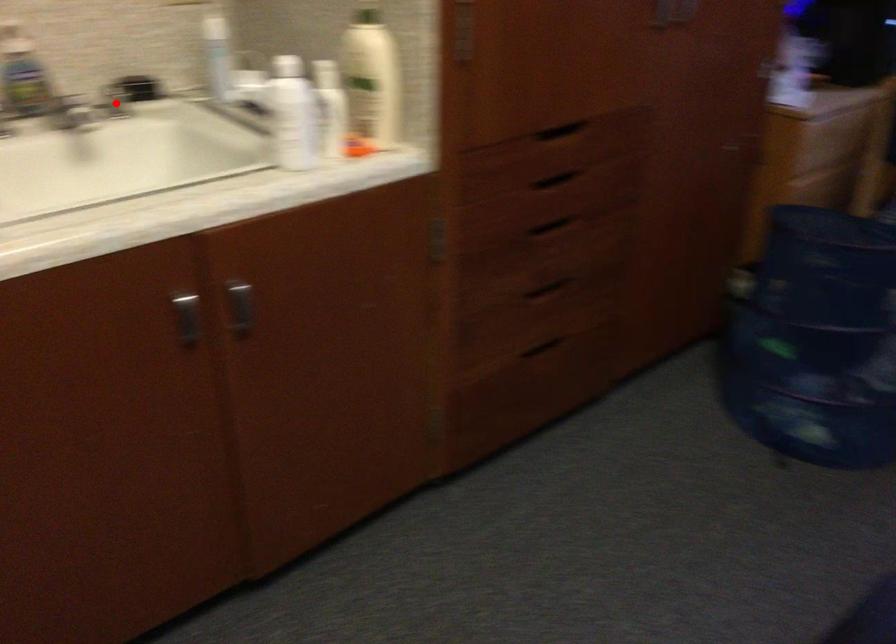
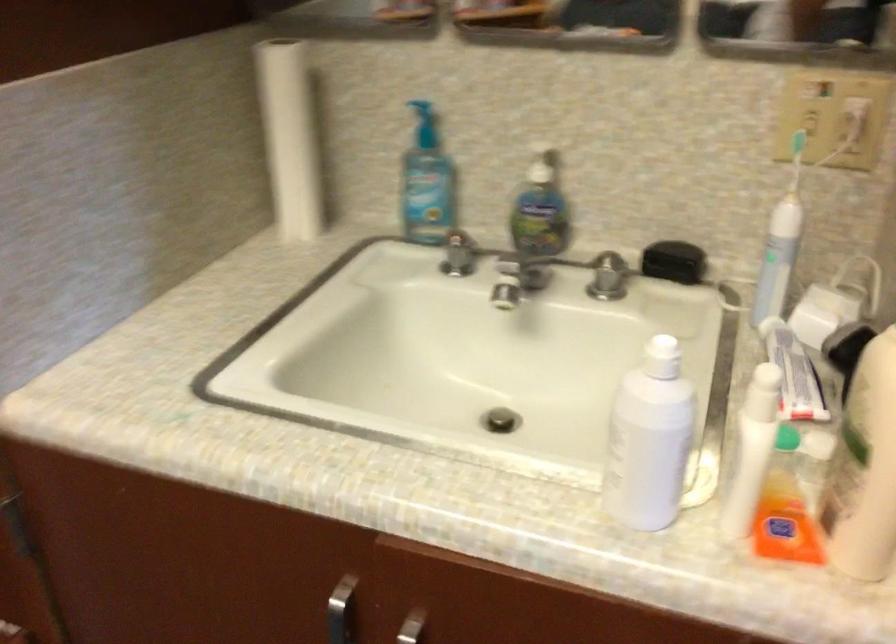
Locate, in the second image, the point that corresponds to the highlighted location in the first image.

(607, 277)